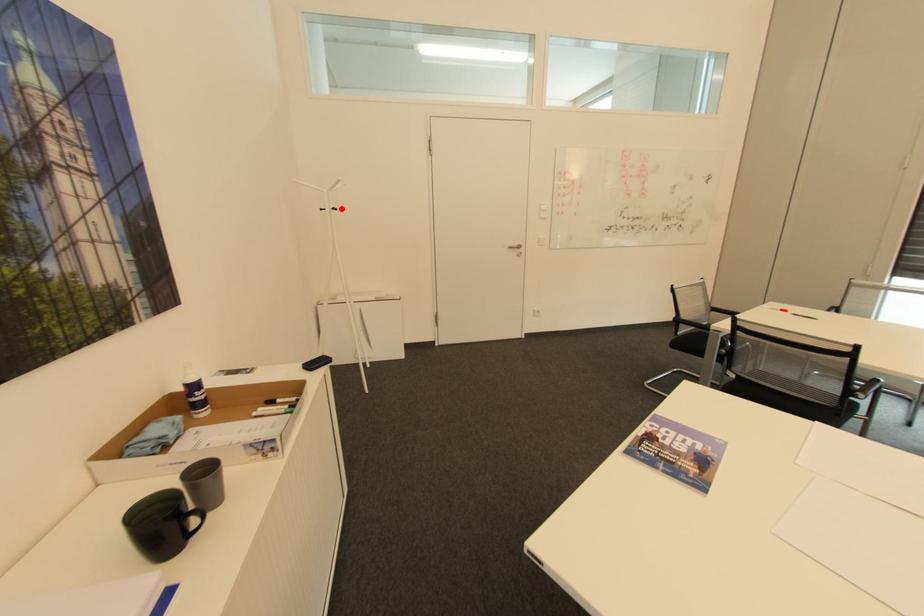
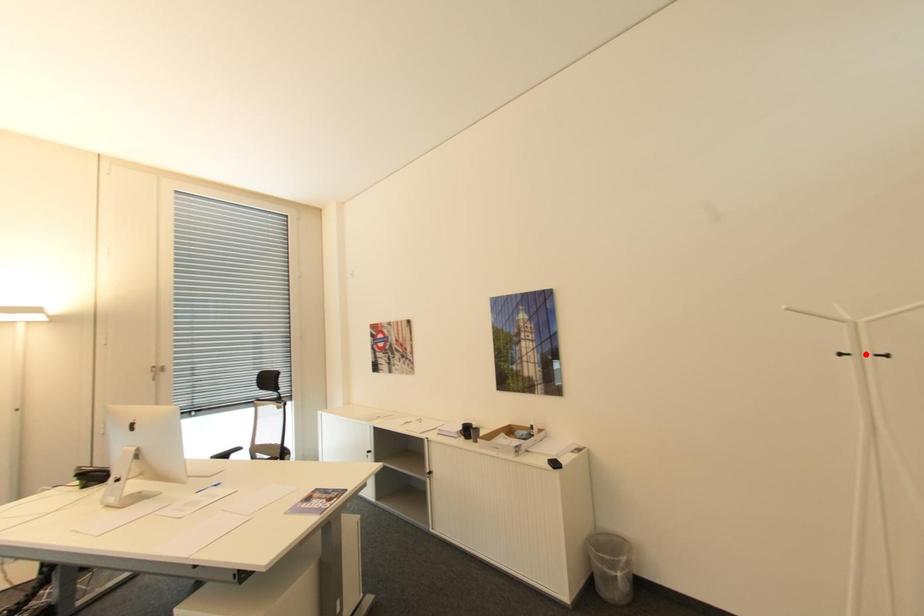
I am providing you with two images of the same scene from different viewpoints. A red point is marked on the first image and another point is marked on the second image. Is the marked point in image1 the same physical position as the marked point in image2?

No